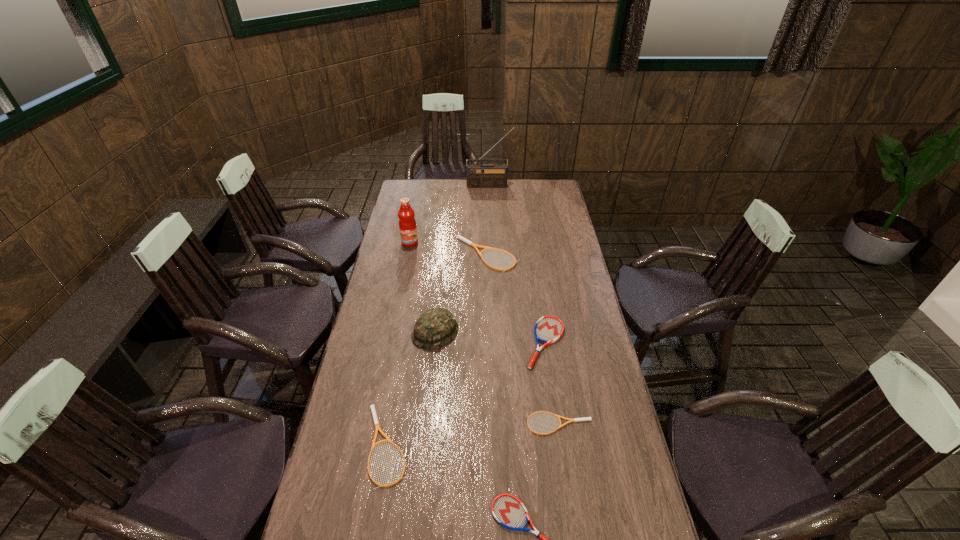
The height and width of the screenshot is (540, 960). I want to click on the smallest beige tennis racket, so click(558, 416).

Locate an element on the screen. The image size is (960, 540). vacant space located on the front-facing side of the farthest object is located at coordinates (491, 219).

Where is `free region located 0.120m on the front label of the seventh shortest object`? This screenshot has height=540, width=960. free region located 0.120m on the front label of the seventh shortest object is located at coordinates (406, 264).

The height and width of the screenshot is (540, 960). I want to click on vacant space situated 0.400m on the right of the headwear, so click(x=562, y=333).

Locate an element on the screen. Image resolution: width=960 pixels, height=540 pixels. free region located 0.120m on the back of the biggest beige tennis racket is located at coordinates (487, 224).

At what (x,y) coordinates should I click in order to perform the action: click on free space located on the front of the farther blue tennis racket. Please return your answer as a coordinate pair (x, y). Looking at the image, I should click on (564, 466).

Where is `vacant space situated 0.290m on the right of the leftmost tennis racket`? vacant space situated 0.290m on the right of the leftmost tennis racket is located at coordinates (507, 446).

Locate an element on the screen. vacant space positioned on the back of the smallest beige tennis racket is located at coordinates (547, 344).

Where is `object that is at the far edge`? The width and height of the screenshot is (960, 540). object that is at the far edge is located at coordinates (478, 175).

Where is `fruit juice present at the left edge`? fruit juice present at the left edge is located at coordinates (407, 224).